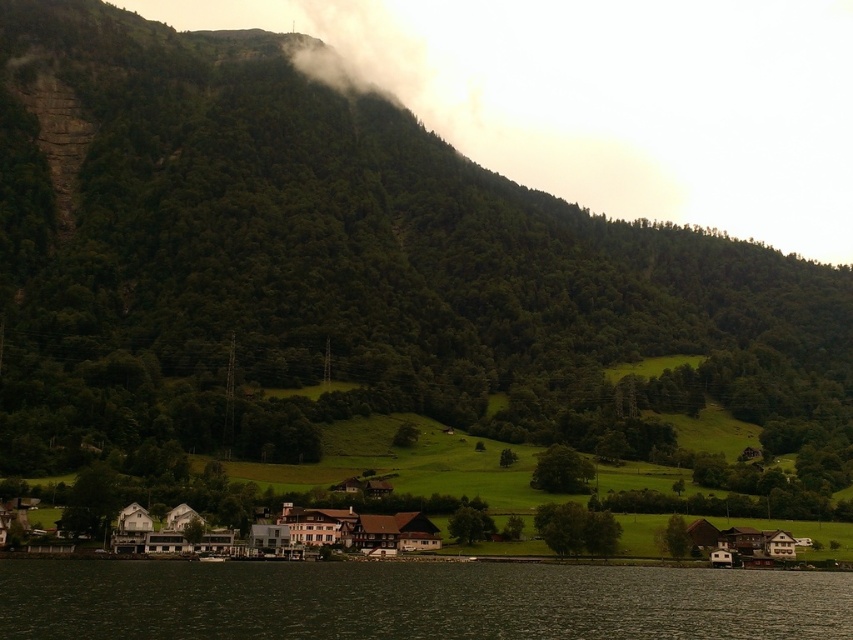
Which is in front, point (604, 595) or point (302, 61)?

Positioned in front is point (604, 595).

Looking at this image, is dark green water at lower center thinner than white fog at upper center?

Correct, dark green water at lower center's width is less than white fog at upper center's.

Does point (276, 582) come farther from viewer compared to point (618, 152)?

No, it is in front of (618, 152).

What are the coordinates of `dark green water at lower center` in the screenshot? It's located at (415, 602).